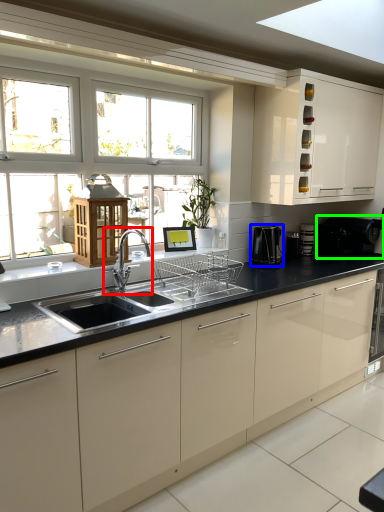
Question: Based on their relative distances, which object is farther from tap (highlighted by a red box)? Choose from coffee machine (highlighted by a blue box) and appliance (highlighted by a green box).

Choices:
 (A) coffee machine
 (B) appliance

Answer: (B)